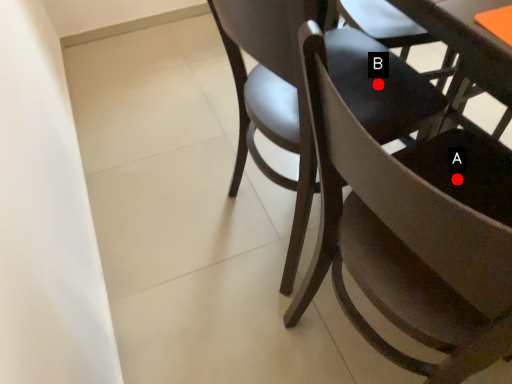
Question: Two points are circled on the image, labeled by A and B beside each circle. Among these points, which one is farthest from the camera?

Choices:
 (A) A is further
 (B) B is further

Answer: (B)